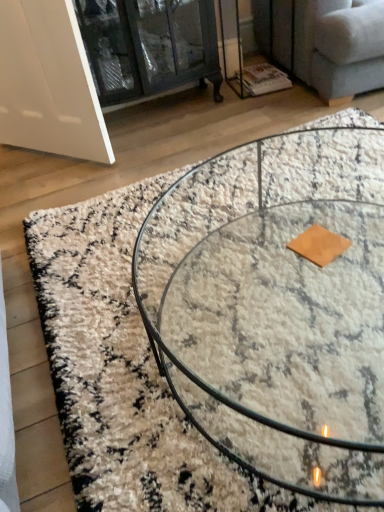
Locate an element on the screen. This screenshot has width=384, height=512. vacant space underneath clear glass cabinet at upper left (from a real-world perspective) is located at coordinates (141, 114).